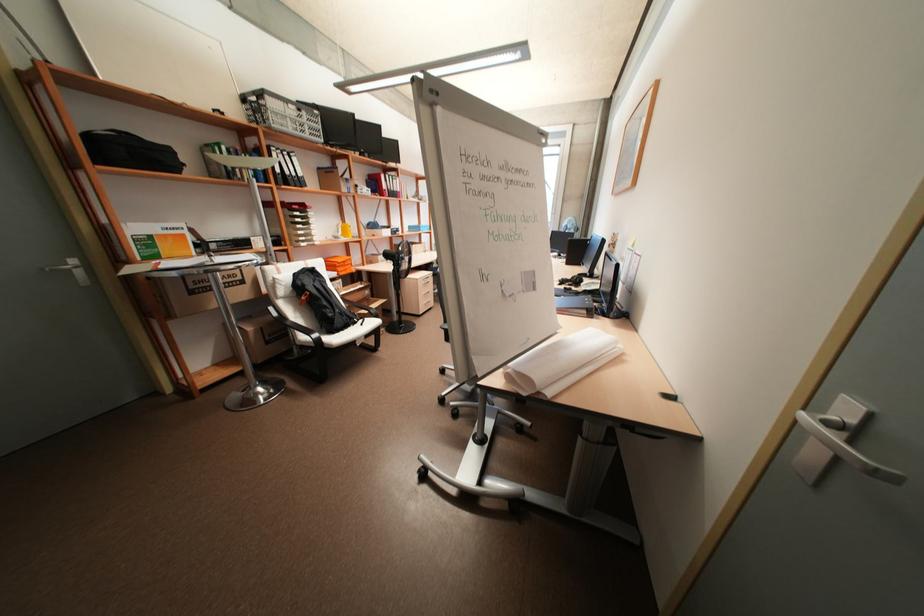
This screenshot has height=616, width=924. What do you see at coordinates (298, 333) in the screenshot?
I see `the black chair armrest` at bounding box center [298, 333].